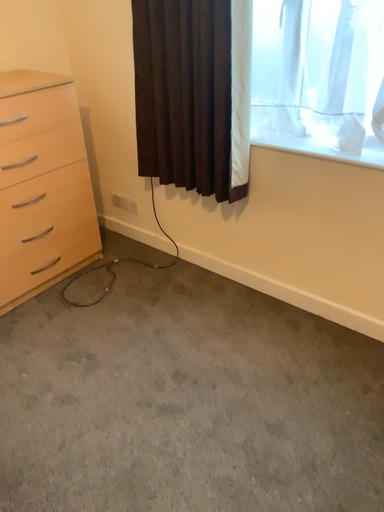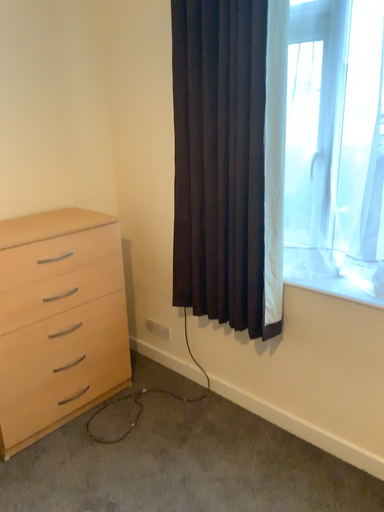
Question: How did the camera likely rotate when shooting the video?

Choices:
 (A) rotated upward
 (B) rotated downward

Answer: (A)